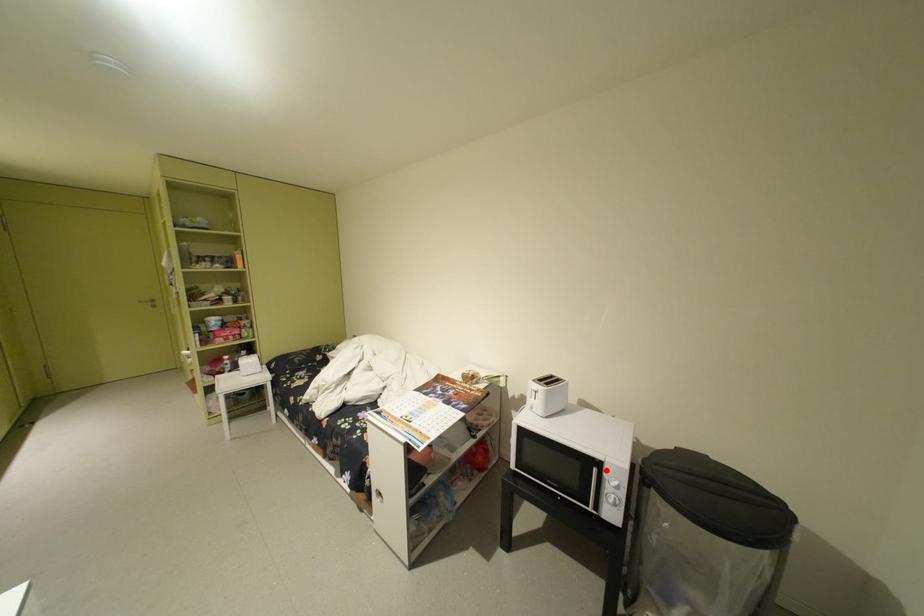
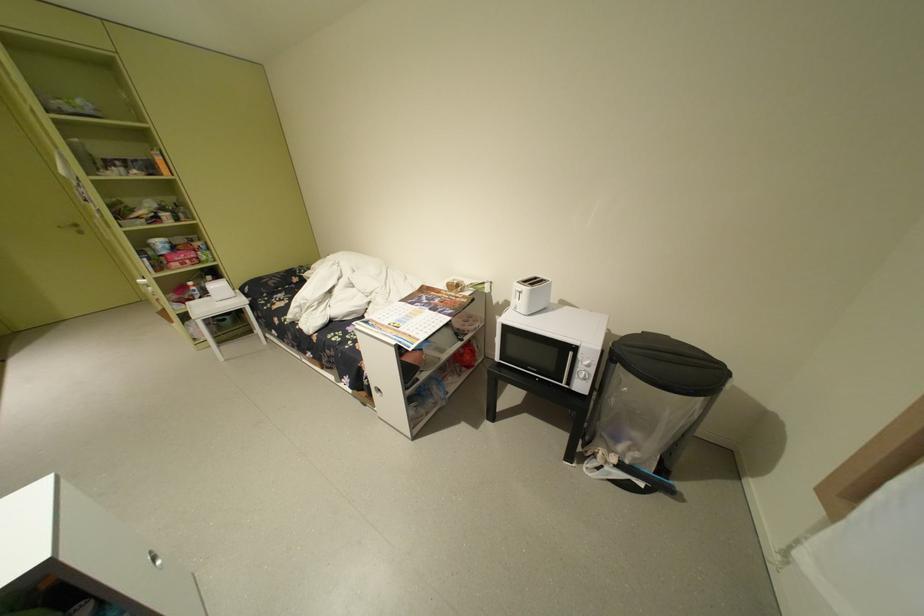
The point at the highlighted location is marked in the first image. Where is the corresponding point in the second image?

(581, 354)